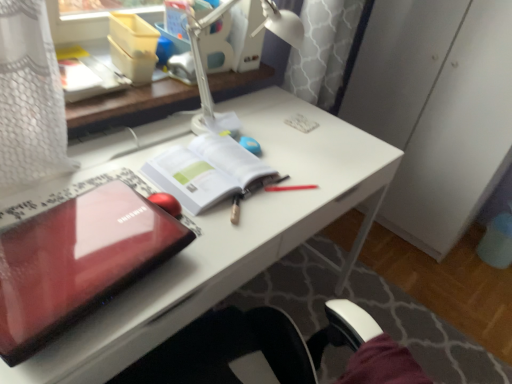
Locate an element on the screen. vacant space in between white plastic lamp at upper center and white paper at center is located at coordinates (253, 151).